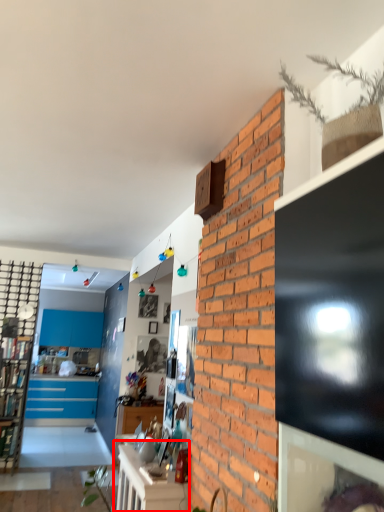
Question: Where is table (annotated by the red box) located in relation to cabinetry in the image?

Choices:
 (A) right
 (B) left

Answer: (A)